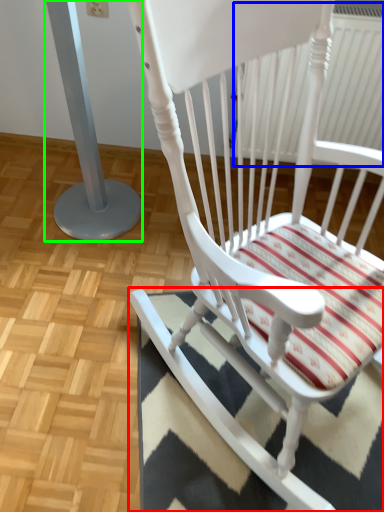
Question: Based on their relative distances, which object is nearer to doormat (highlighted by a red box)? Choose from radiator (highlighted by a blue box) and pillar (highlighted by a green box).

Choices:
 (A) radiator
 (B) pillar

Answer: (B)